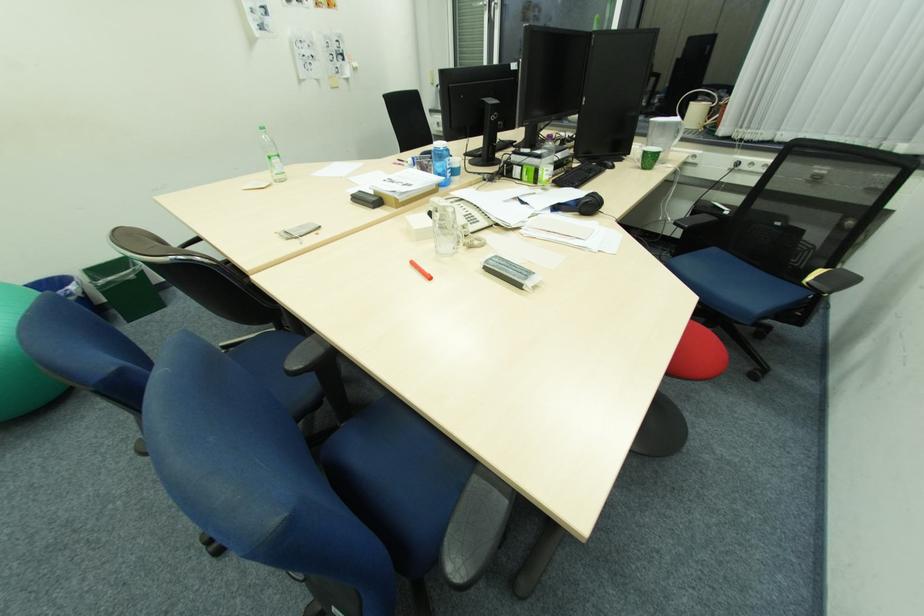
The location [698,354] corresponds to which object?

It refers to a red stool.